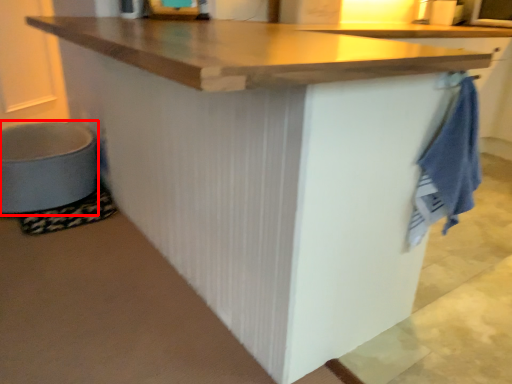
Question: From the image's perspective, where is step stool (annotated by the red box) located relative to bath towel?

Choices:
 (A) above
 (B) below

Answer: (A)